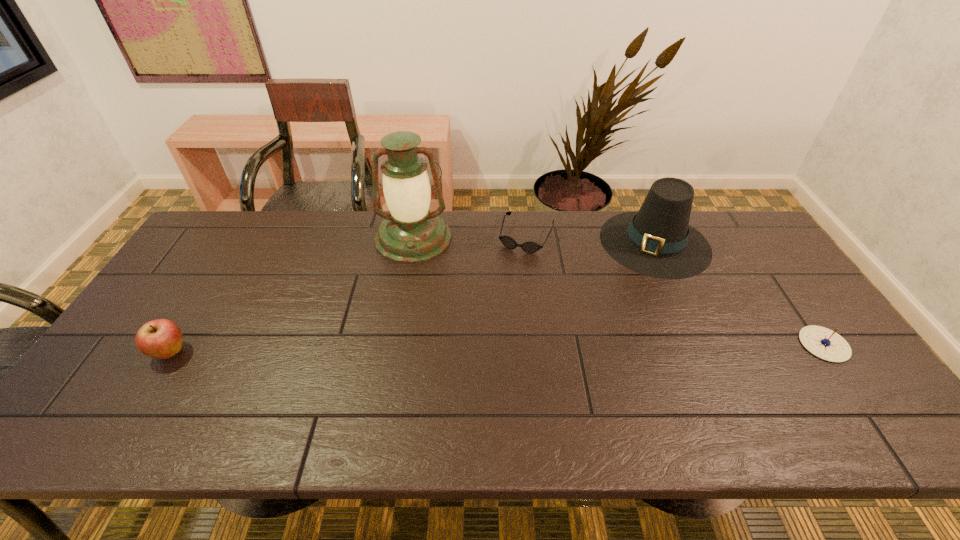
Find the location of a particular element. Image resolution: width=960 pixels, height=540 pixels. vacant space on the desktop that is between the apple and the fourth tallest object and is positioned with the light compartment facing forward on the second object from left to right is located at coordinates (406, 349).

This screenshot has height=540, width=960. Identify the location of vacant space on the desktop that is between the apple and the compass and is positioned on the lenses of the shortest object. point(478,348).

Identify the location of vacant space on the desktop that is between the apple and the fourth tallest object and is positioned on the front-facing side of the second object from right to left. (578, 347).